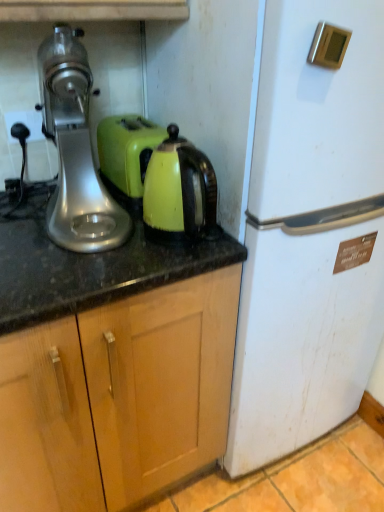
This screenshot has width=384, height=512. I want to click on vacant area situated to the left side of silver metallic stand mixer at left, so click(20, 215).